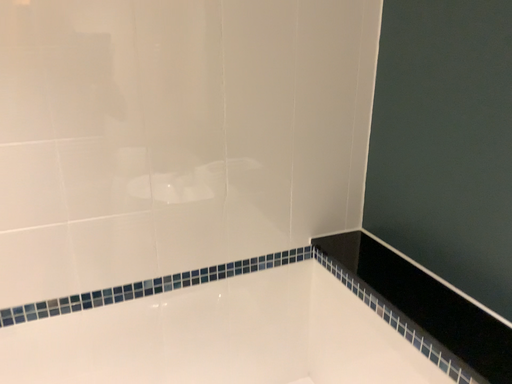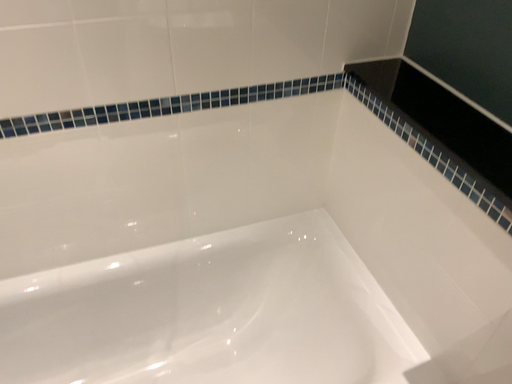
Question: How did the camera likely rotate when shooting the video?

Choices:
 (A) rotated upward
 (B) rotated downward

Answer: (B)